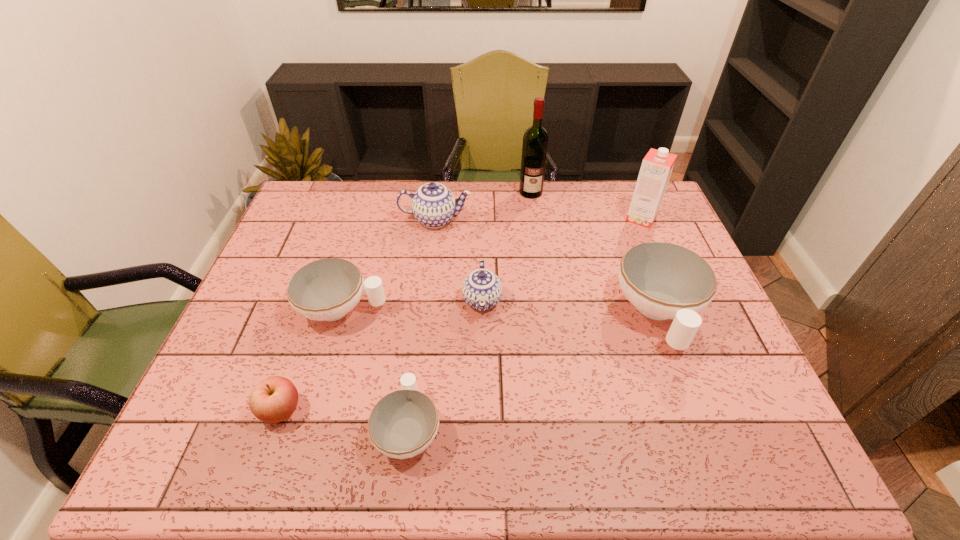
Find the location of a particular element. The width and height of the screenshot is (960, 540). the closest chinaware to the leftmost white chinaware is located at coordinates (402, 424).

Select which chinaware appears as the second closest to the green alcohol. Please provide its 2D coordinates. Your answer should be formatted as a tuple, i.e. [(x, y)], where the tuple contains the x and y coordinates of a point satisfying the conditions above.

[(482, 289)]

Where is `white chinaware that is the second closest one to the leftmost white chinaware`? white chinaware that is the second closest one to the leftmost white chinaware is located at coordinates (662, 280).

The image size is (960, 540). In order to click on white chinaware that is the second closest to the rightmost chinaware in this screenshot , I will do `click(327, 289)`.

Identify the location of vacant space that satisfies the following two spatial constraints: 1. on the front and back of the alcohol; 2. on the side with the handle of the second smallest white chinaware. Image resolution: width=960 pixels, height=540 pixels. (547, 309).